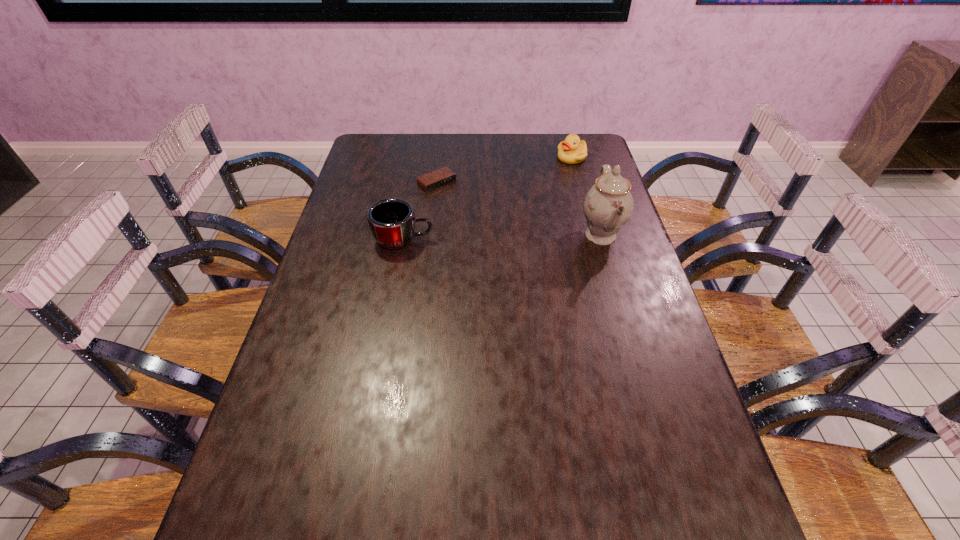
At what (x,y) coordinates should I click in order to perform the action: click on mug. Please return your answer as a coordinate pair (x, y). The image size is (960, 540). Looking at the image, I should click on (392, 221).

Locate an element on the screen. the tallest object is located at coordinates (608, 205).

Locate an element on the screen. duckling is located at coordinates (572, 150).

Identify the location of the third nearest object. Image resolution: width=960 pixels, height=540 pixels. (439, 178).

This screenshot has width=960, height=540. Find the location of `alarm clock`. alarm clock is located at coordinates (439, 178).

This screenshot has height=540, width=960. Identify the location of free point located on the side of the mug with the handle. (464, 240).

Identify the location of free space located on the front-facing side of the duckling. (557, 177).

Where is `vacant space positioned on the front-facing side of the duckling`? The width and height of the screenshot is (960, 540). vacant space positioned on the front-facing side of the duckling is located at coordinates (530, 213).

Where is `free spot located 0.210m on the front-facing side of the duckling`? free spot located 0.210m on the front-facing side of the duckling is located at coordinates (543, 195).

Locate an element on the screen. free point located 0.360m on the front face of the alarm clock is located at coordinates (516, 250).